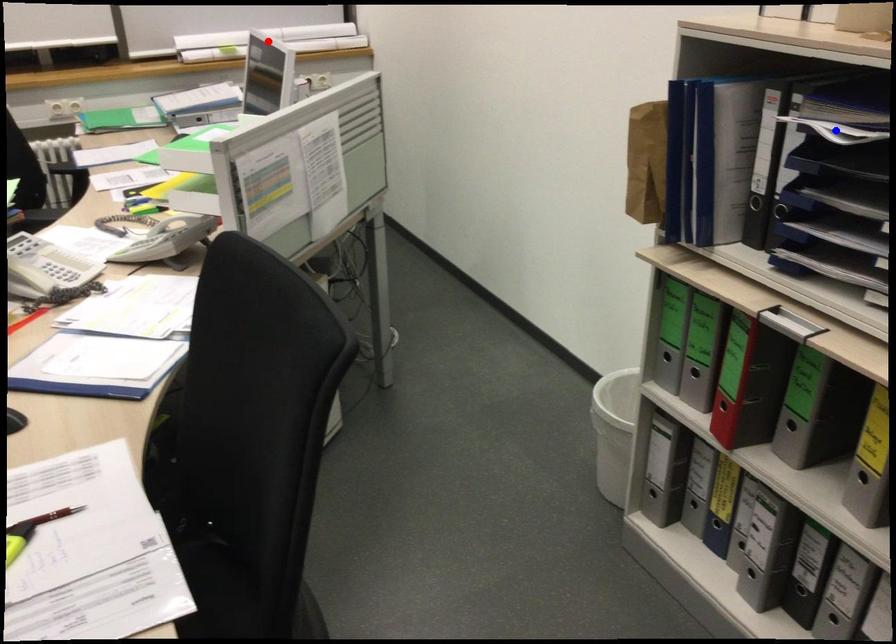
Question: Two points are marked on the image. Which point is closer to the camera?

Choices:
 (A) Blue point is closer.
 (B) Red point is closer.

Answer: (A)